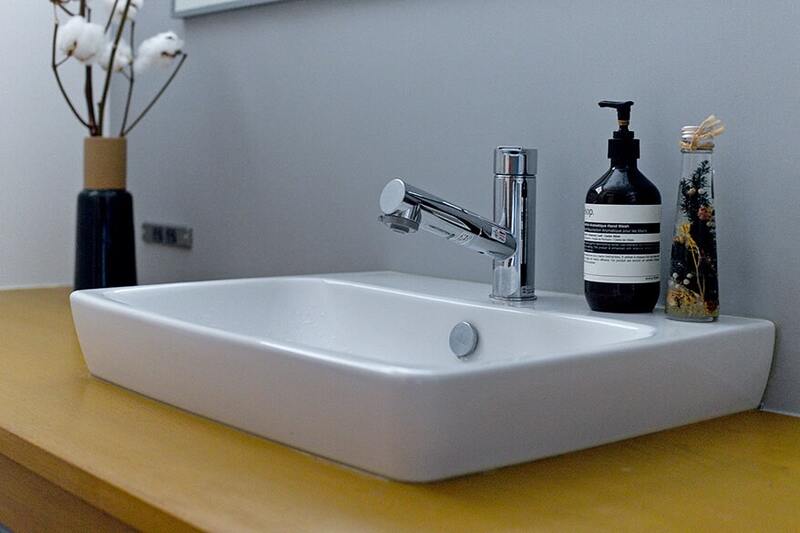
You are a GUI agent. You are given a task and a screenshot of the screen. Output one action in this format:
    pyautogui.click(x=<x>, y=<y>)
    Task: Click on the empty space to the right of sink
    This screenshot has height=533, width=800.
    Given the screenshot: What is the action you would take?
    pyautogui.click(x=688, y=491)